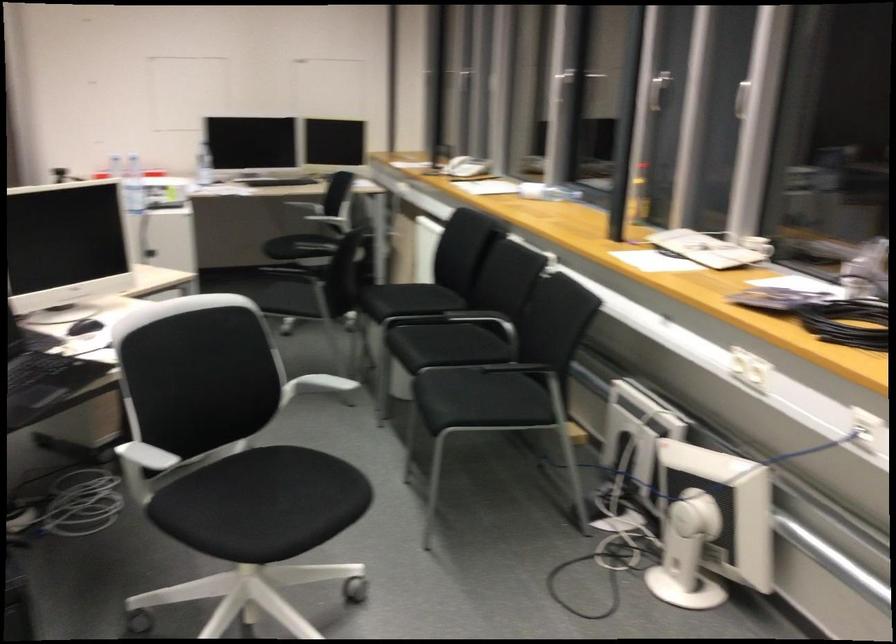
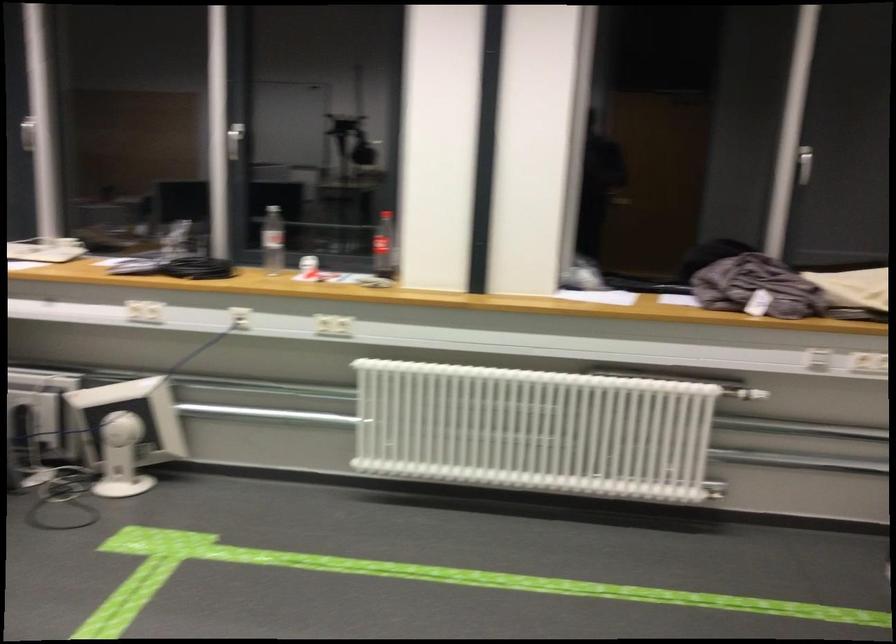
The point at (694, 524) is marked in the first image. Where is the corresponding point in the second image?

(126, 431)